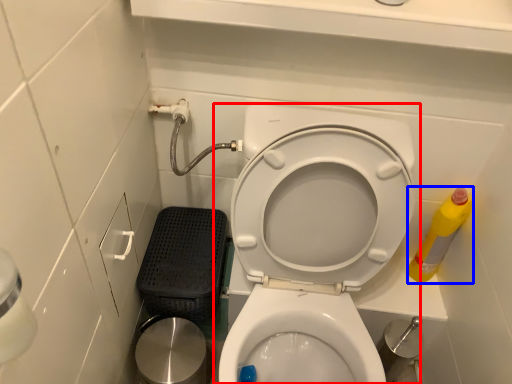
Question: Among these objects, which one is farthest to the camera, toilet (highlighted by a red box) or cleaning product (highlighted by a blue box)?

Choices:
 (A) toilet
 (B) cleaning product

Answer: (B)